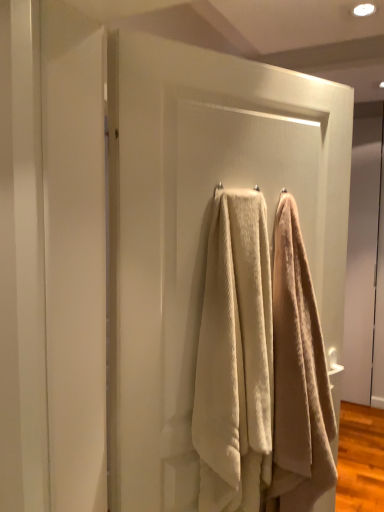
Question: Considering the relative sizes of beige textured towel at center, which is the 1th towel in right-to-left order, and white textured towel at center in the image provided, is beige textured towel at center, which is the 1th towel in right-to-left order, taller than white textured towel at center?

Choices:
 (A) yes
 (B) no

Answer: (B)

Question: Is beige textured towel at center, the 2th towel from the left, next to white textured towel at center and touching it?

Choices:
 (A) no
 (B) yes

Answer: (A)

Question: Is beige textured towel at center, which is the 1th towel in right-to-left order, smaller than white textured towel at center?

Choices:
 (A) no
 (B) yes

Answer: (B)

Question: From a real-world perspective, is beige textured towel at center, the 2th towel from the left, located higher than white textured towel at center?

Choices:
 (A) yes
 (B) no

Answer: (B)

Question: Is beige textured towel at center, the 2th towel from the left, thinner than white textured towel at center?

Choices:
 (A) yes
 (B) no

Answer: (B)

Question: Can you confirm if beige textured towel at center, the 2th towel from the left, is positioned to the left of white textured towel at center?

Choices:
 (A) no
 (B) yes

Answer: (A)

Question: Does beige textured towel at center, placed as the 2th towel when sorted from right to left, come in front of white textured towel at center?

Choices:
 (A) no
 (B) yes

Answer: (A)

Question: Is beige textured towel at center, placed as the 2th towel when sorted from right to left, wider than white textured towel at center?

Choices:
 (A) yes
 (B) no

Answer: (A)

Question: Does beige textured towel at center, placed as the 2th towel when sorted from right to left, turn towards white textured towel at center?

Choices:
 (A) no
 (B) yes

Answer: (B)

Question: Is beige textured towel at center, placed as the 2th towel when sorted from right to left, taller than white textured towel at center?

Choices:
 (A) no
 (B) yes

Answer: (A)

Question: Is white textured towel at center at the back of beige textured towel at center, which ranks as the 1th towel in left-to-right order?

Choices:
 (A) no
 (B) yes

Answer: (B)

Question: From the image's perspective, is beige textured towel at center, placed as the 2th towel when sorted from right to left, below white textured towel at center?

Choices:
 (A) no
 (B) yes

Answer: (B)

Question: Considering the relative sizes of beige textured towel at center, the 2th towel from the left, and beige textured towel at center, which ranks as the 1th towel in left-to-right order, in the image provided, is beige textured towel at center, the 2th towel from the left, wider than beige textured towel at center, which ranks as the 1th towel in left-to-right order,?

Choices:
 (A) no
 (B) yes

Answer: (B)